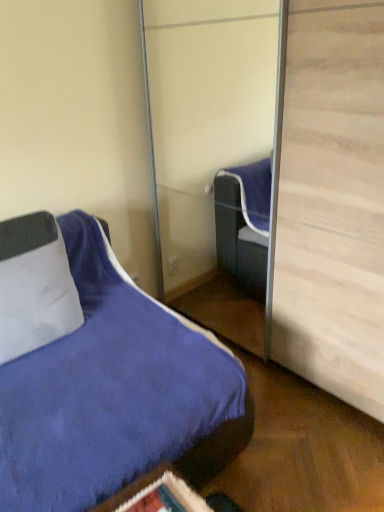
Question: Does white textured pillow at left touch suede blue bed at lower left?

Choices:
 (A) no
 (B) yes

Answer: (A)

Question: Considering the relative sizes of white textured pillow at left and suede blue bed at lower left in the image provided, is white textured pillow at left smaller than suede blue bed at lower left?

Choices:
 (A) no
 (B) yes

Answer: (B)

Question: Would you say white textured pillow at left contains suede blue bed at lower left?

Choices:
 (A) yes
 (B) no

Answer: (B)

Question: Considering the relative positions of white textured pillow at left and suede blue bed at lower left in the image provided, is white textured pillow at left behind suede blue bed at lower left?

Choices:
 (A) yes
 (B) no

Answer: (A)

Question: From the image's perspective, is white textured pillow at left located above suede blue bed at lower left?

Choices:
 (A) yes
 (B) no

Answer: (A)

Question: Does white textured pillow at left turn towards suede blue bed at lower left?

Choices:
 (A) yes
 (B) no

Answer: (A)

Question: Is suede blue bed at lower left wider than white textured pillow at left?

Choices:
 (A) no
 (B) yes

Answer: (B)

Question: From a real-world perspective, is suede blue bed at lower left over white textured pillow at left?

Choices:
 (A) no
 (B) yes

Answer: (A)

Question: Can you confirm if suede blue bed at lower left is bigger than white textured pillow at left?

Choices:
 (A) no
 (B) yes

Answer: (B)

Question: Is suede blue bed at lower left oriented away from white textured pillow at left?

Choices:
 (A) yes
 (B) no

Answer: (B)

Question: Considering the relative sizes of suede blue bed at lower left and white textured pillow at left in the image provided, is suede blue bed at lower left taller than white textured pillow at left?

Choices:
 (A) no
 (B) yes

Answer: (B)

Question: Is suede blue bed at lower left thinner than white textured pillow at left?

Choices:
 (A) no
 (B) yes

Answer: (A)

Question: Considering their positions, is suede blue bed at lower left located in front of or behind white textured pillow at left?

Choices:
 (A) behind
 (B) front

Answer: (B)